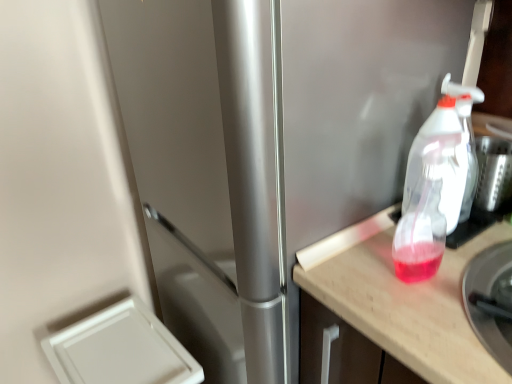
Identify the location of vacant space situated on the left part of transparent plastic spray bottle at right. (366, 242).